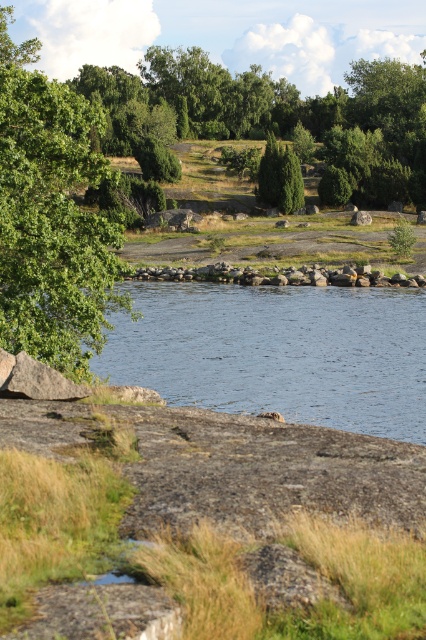
Question: Which of these objects is positioned closest to the clear water at center?

Choices:
 (A) gray rock wall at center
 (B) green leafy tree at left

Answer: (A)

Question: Considering the real-world distances, which object is farthest from the gray rock wall at center?

Choices:
 (A) clear water at center
 (B) green leafy tree at left

Answer: (B)

Question: Among these objects, which one is nearest to the camera?

Choices:
 (A) green leafy tree at left
 (B) clear water at center

Answer: (A)

Question: Is green leafy tree at left bigger than gray rock wall at center?

Choices:
 (A) yes
 (B) no

Answer: (A)

Question: Does clear water at center appear on the right side of green leafy tree at left?

Choices:
 (A) no
 (B) yes

Answer: (B)

Question: Does green leafy tree at left appear under gray rock wall at center?

Choices:
 (A) no
 (B) yes

Answer: (A)